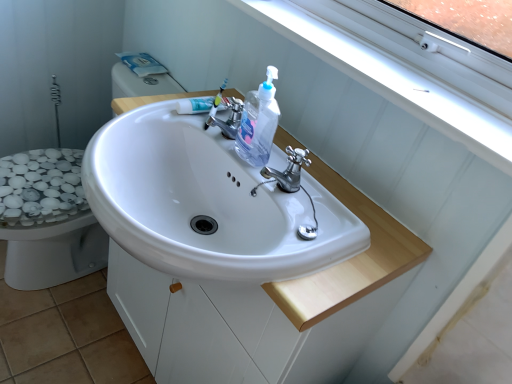
Locate an element on the screen. This screenshot has height=384, width=512. vacant space to the left of white plastic toothbrush at center is located at coordinates (157, 105).